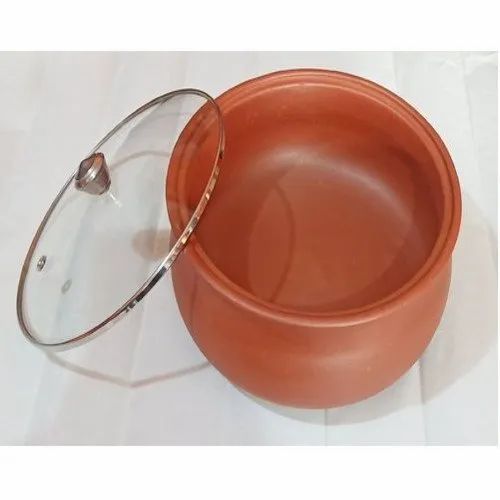
Find the location of a particular element. red/orange pot is located at coordinates (363, 351).